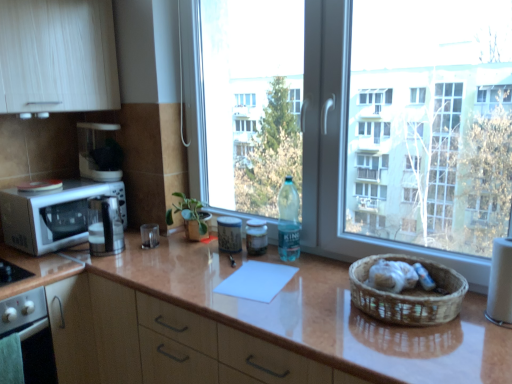
Question: From their relative heights in the image, would you say brown woven basket at right is taller or shorter than matte glass jar at center, positioned as the 3th appliance in front-to-back order?

Choices:
 (A) short
 (B) tall

Answer: (A)

Question: From a real-world perspective, is brown woven basket at right above or below matte glass jar at center, the 3th appliance positioned from the bottom?

Choices:
 (A) above
 (B) below

Answer: (B)

Question: Considering the real-world distances, which object is farthest from the white glossy microwave oven at left?

Choices:
 (A) white glossy oven at lower left
 (B) satin silver coffee machine at center
 (C) matte glass jar at center, positioned as the 3th appliance in front-to-back order
 (D) matte white coffee maker at upper left, the first appliance positioned from the left
 (E) transparent glass window at center

Answer: (E)

Question: Which object is the closest to the brown woven basket at right?

Choices:
 (A) glossy brown countertop at center
 (B) white glossy oven at lower left
 (C) satin silver coffee machine at center
 (D) matte glass jar at center, the 2th appliance in the left-to-right sequence
 (E) matte white coffee maker at upper left, acting as the 1th appliance starting from the top

Answer: (A)